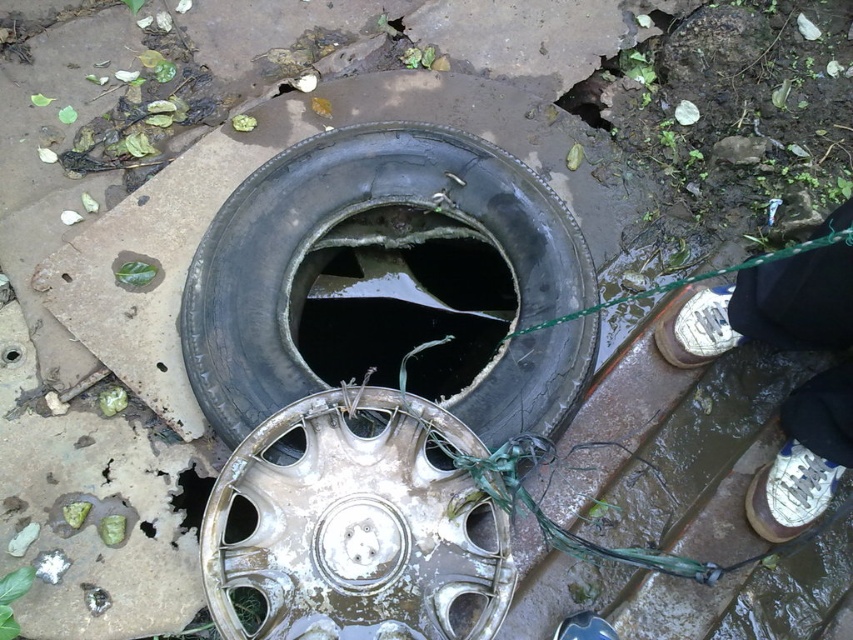
Question: Which object appears farthest from the camera in this image?

Choices:
 (A) black rubber tire at center
 (B) black rubber hole at center
 (C) white leather shoe at lower right
 (D) white leather shoe at right

Answer: (D)

Question: Can you confirm if silver metallic hubcap at center is positioned above black rubber hole at center?

Choices:
 (A) no
 (B) yes

Answer: (A)

Question: Which object appears farthest from the camera in this image?

Choices:
 (A) black rubber hole at center
 (B) silver metallic hubcap at center
 (C) white leather shoe at right

Answer: (C)

Question: Can you confirm if silver metallic hubcap at center is positioned below white leather sneakers at lower right?

Choices:
 (A) no
 (B) yes

Answer: (B)

Question: Is black rubber hole at center below white leather shoe at lower right?

Choices:
 (A) no
 (B) yes

Answer: (A)

Question: Which of the following is the closest to the observer?

Choices:
 (A) black rubber hole at center
 (B) white leather shoe at right
 (C) white leather shoe at lower right
 (D) silver metallic hubcap at center

Answer: (D)